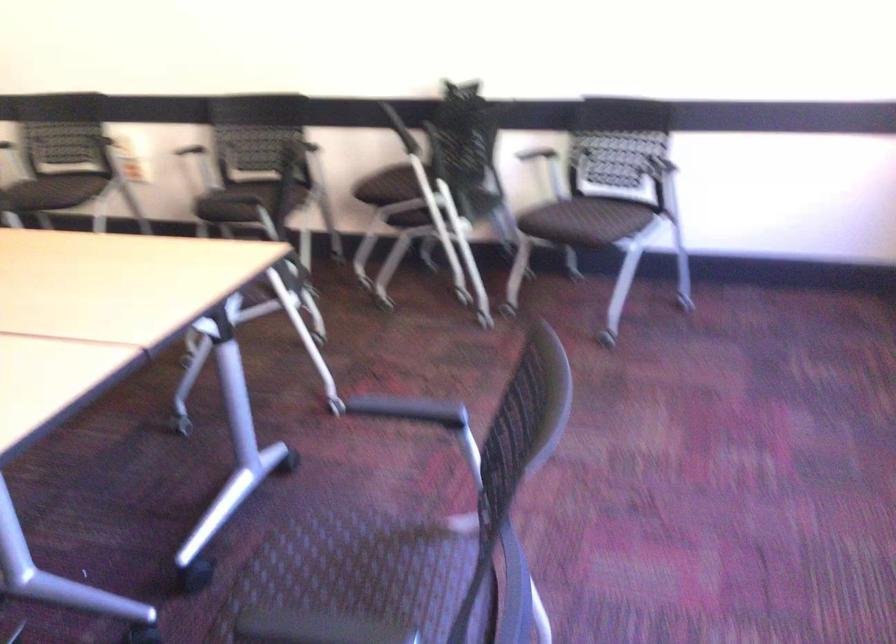
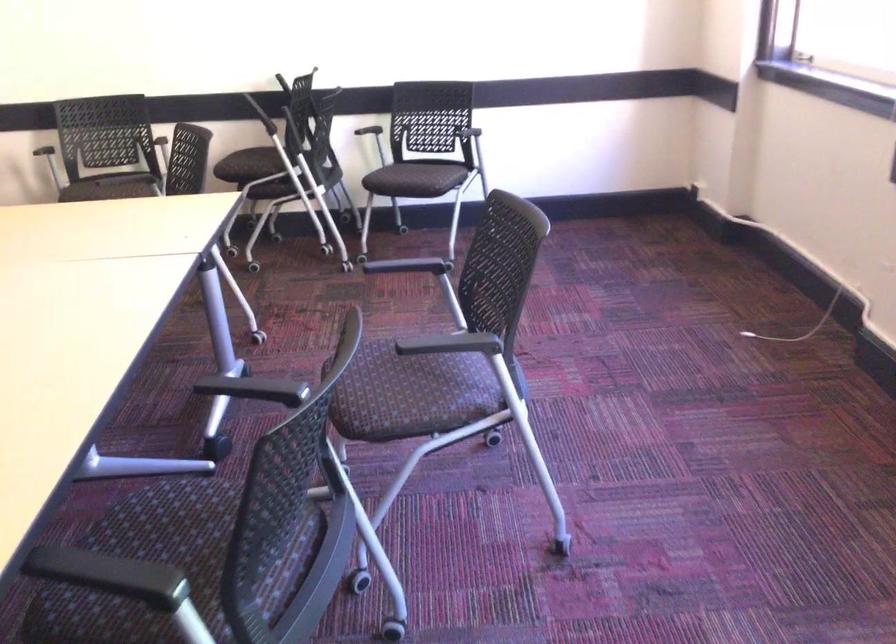
In the second image, find the point that corresponds to (x=395, y=192) in the first image.

(252, 166)